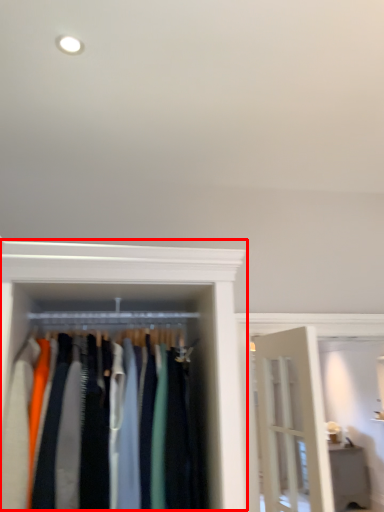
Question: From the image's perspective, what is the correct spatial relationship of closet (annotated by the red box) in relation to furniture?

Choices:
 (A) below
 (B) above

Answer: (B)